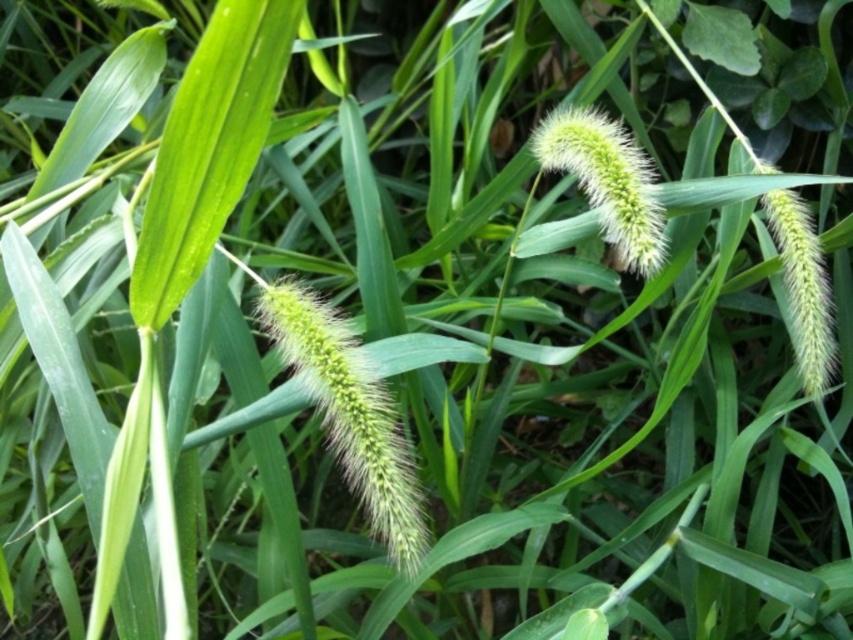
Question: Can you confirm if green fuzzy grass at center is smaller than green fuzzy flower at center?

Choices:
 (A) no
 (B) yes

Answer: (A)

Question: Is green fuzzy grass at center thinner than green fuzzy flower at center?

Choices:
 (A) no
 (B) yes

Answer: (A)

Question: Which of the following is the closest to the observer?

Choices:
 (A) (637, 177)
 (B) (270, 317)

Answer: (B)

Question: Among these objects, which one is farthest from the camera?

Choices:
 (A) green fuzzy flower at center
 (B) green fuzzy grass at center

Answer: (A)

Question: Where is green fuzzy grass at center located in relation to green fuzzy flower at center in the image?

Choices:
 (A) below
 (B) above

Answer: (A)